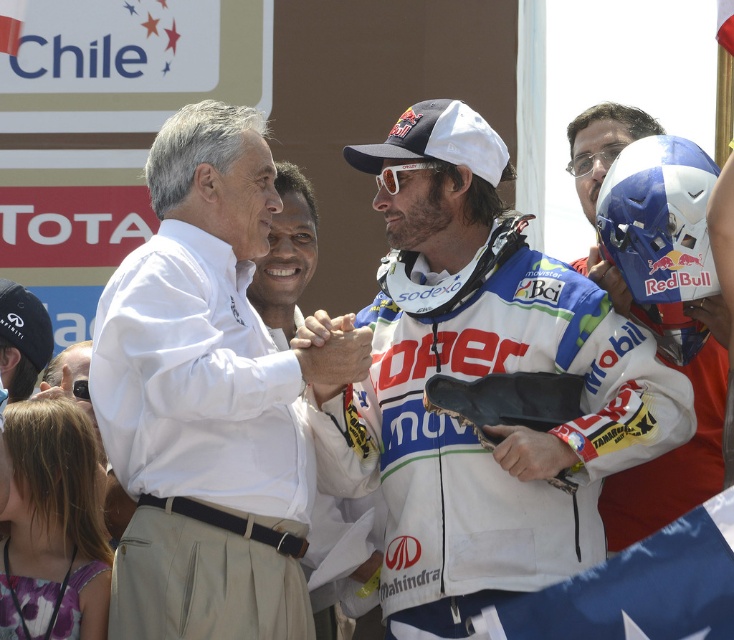
Question: Which object is the closest to the white matte goggles at center?

Choices:
 (A) blue matte helmet at right
 (B) white cotton shirt at center

Answer: (A)

Question: Which of the following is the farthest from the observer?

Choices:
 (A) (219, 408)
 (B) (413, 168)
 (C) (658, 214)

Answer: (B)

Question: Is white cotton shirt at center wider than blue matte helmet at right?

Choices:
 (A) no
 (B) yes

Answer: (B)

Question: Is the position of white matte jacket at center less distant than that of blue fabric flag at center?

Choices:
 (A) no
 (B) yes

Answer: (A)

Question: Which point appears closest to the camera in this image?

Choices:
 (A) (523, 333)
 (B) (705, 332)
 (C) (396, 192)

Answer: (A)

Question: Does white matte jacket at center appear under blue matte helmet at right?

Choices:
 (A) no
 (B) yes

Answer: (B)